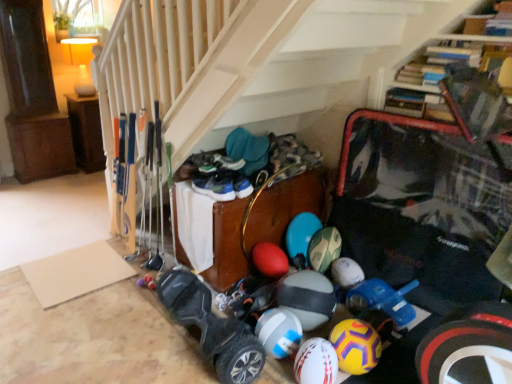
Locate an element on the screen. The image size is (512, 384). unoccupied region to the right of white matte bowling ball at lower center, placed as the 1th bowling ball when sorted from right to left is located at coordinates (389, 366).